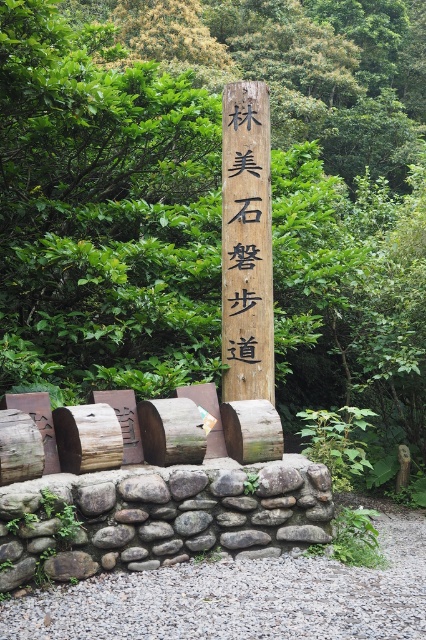
You are a hiker who just arrived at the trailhead and see the gray rough stone wall at lower center and the wooden signpost at center. You want to take a photo of both objects in the same frame. Which object should you move closer to in order to include both in the photo?

To include both the gray rough stone wall at lower center and the wooden signpost at center in the same frame, you should move closer to the gray rough stone wall at lower center since it is closer to you than the wooden signpost at center. This will allow both objects to be captured within the camera view.

Based on the photo, you are a hiker who wants to take a photo of both the gray rough stone wall at lower center and the wooden signpost at center. Since you need to frame both in the same shot, which object should you position closer to the camera to ensure both fit in the frame?

The gray rough stone wall at lower center is wider than the wooden signpost at center. To fit both in the frame, position the gray rough stone wall at lower center closer to the camera so its larger width occupies less space in the photo, allowing the narrower wooden signpost at center to be included as well.